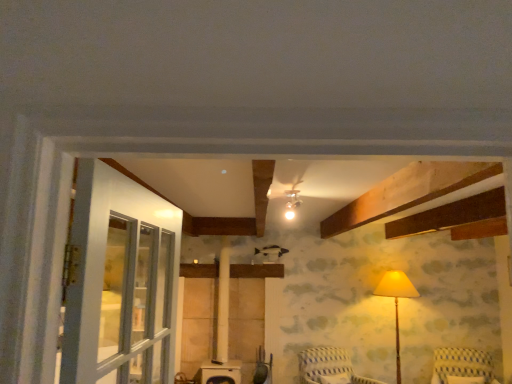
Question: Looking at the image, does matte yellow fabric lampshade at right seem bigger or smaller compared to striped fabric chair at lower center, acting as the first furniture starting from the left?

Choices:
 (A) small
 (B) big

Answer: (B)

Question: Relative to striped fabric chair at lower center, the second furniture in the right-to-left sequence, is matte yellow fabric lampshade at right in front or behind?

Choices:
 (A) front
 (B) behind

Answer: (B)

Question: Estimate the real-world distances between objects in this image. Which object is farther from the striped fabric chair at lower center, the second furniture in the right-to-left sequence?

Choices:
 (A) yellow striped fabric chair at lower right, which is the second furniture from left to right
 (B) matte yellow fabric lampshade at right

Answer: (A)

Question: Estimate the real-world distances between objects in this image. Which object is farther from the striped fabric chair at lower center, the second furniture in the right-to-left sequence?

Choices:
 (A) yellow striped fabric chair at lower right, which is the second furniture from left to right
 (B) matte yellow fabric lampshade at right

Answer: (A)